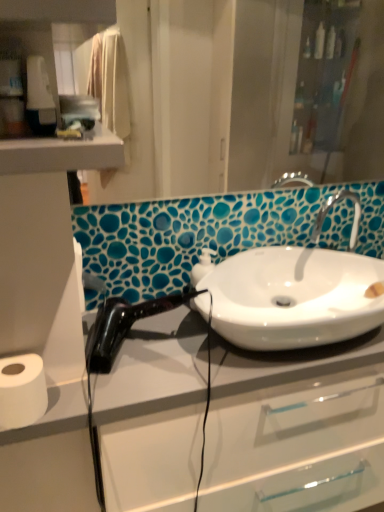
What do you see at coordinates (294, 297) in the screenshot? This screenshot has width=384, height=512. I see `white glossy sink at center` at bounding box center [294, 297].

What is the approximate width of black plastic hair dryer at upper left?

The width of black plastic hair dryer at upper left is 1.94 inches.

Locate an element on the screen. black glossy hair dryer at left is located at coordinates (123, 326).

What do you see at coordinates (22, 391) in the screenshot? I see `white matte toilet paper at lower left` at bounding box center [22, 391].

In order to face matte glass mirror at upper center, should I rotate leftwards or rightwards?

To face it directly, rotate right by 7.684 degrees.

The width and height of the screenshot is (384, 512). What are the coordinates of `white glossy sink at center` in the screenshot? It's located at (294, 297).

Relative to matte glass mirror at upper center, is black plastic hair dryer at upper left in front or behind?

Clearly, black plastic hair dryer at upper left is in front of matte glass mirror at upper center.

Could you tell me if black plastic hair dryer at upper left is turned towards matte glass mirror at upper center?

No.

From a real-world perspective, is black plastic hair dryer at upper left positioned over matte glass mirror at upper center based on gravity?

Yes, from a real-world perspective, black plastic hair dryer at upper left is on top of matte glass mirror at upper center.

From the image's perspective, which is below, white matte toilet paper at lower left or black glossy hair dryer at left?

From the image's view, white matte toilet paper at lower left is below.

Is white matte toilet paper at lower left bigger or smaller than black glossy hair dryer at left?

Clearly, white matte toilet paper at lower left is smaller in size than black glossy hair dryer at left.

Which object is closer to the camera, white matte toilet paper at lower left or black glossy hair dryer at left?

white matte toilet paper at lower left is more forward.

Based on their sizes in the image, would you say white glossy sink at center is bigger or smaller than matte glass mirror at upper center?

Considering their sizes, white glossy sink at center takes up more space than matte glass mirror at upper center.

Can you tell me how much white glossy sink at center and matte glass mirror at upper center differ in facing direction?

There is a 0.00346-degree angle between the facing directions of white glossy sink at center and matte glass mirror at upper center.

Is point (360, 272) closer or farther from the camera than point (31, 27)?

Point (360, 272).

From the image's perspective, is white matte toilet paper at lower left located above white glossy sink at center?

Incorrect, from the image's perspective, white matte toilet paper at lower left is lower than white glossy sink at center.

Are white matte toilet paper at lower left and white glossy sink at center far apart?

That's not correct — white matte toilet paper at lower left is a little close to white glossy sink at center.

Consider the image. Between white matte toilet paper at lower left and white glossy sink at center, which one has smaller size?

→ With smaller size is white matte toilet paper at lower left.

Consider the image. Is white matte toilet paper at lower left closer to camera compared to white glossy sink at center?

Yes, white matte toilet paper at lower left is closer to the viewer.

Are white matte toilet paper at lower left and matte glass mirror at upper center far apart?

white matte toilet paper at lower left is far away from matte glass mirror at upper center.

Which of these two, white matte toilet paper at lower left or matte glass mirror at upper center, is bigger?

Bigger between the two is matte glass mirror at upper center.

Can you tell me how much white matte toilet paper at lower left and matte glass mirror at upper center differ in facing direction?

The facing directions of white matte toilet paper at lower left and matte glass mirror at upper center are 0.00309 degrees apart.

From a real-world perspective, is white matte toilet paper at lower left physically below matte glass mirror at upper center?

Yes, from a real-world perspective, white matte toilet paper at lower left is under matte glass mirror at upper center.

The width and height of the screenshot is (384, 512). I want to click on mirror on the left side of white glossy sink at center, so click(x=189, y=88).

Is matte glass mirror at upper center oriented towards white glossy sink at center?

No, matte glass mirror at upper center does not turn towards white glossy sink at center.

Is point (48, 27) positioned behind point (224, 301)?

No, (48, 27) is closer to viewer.

Who is shorter, matte glass mirror at upper center or white glossy sink at center?

Standing shorter between the two is white glossy sink at center.

Which object is further away from the camera taking this photo, white glossy sink at center or black plastic hair dryer at upper left?

white glossy sink at center is more distant.

How distant is white glossy sink at center from black plastic hair dryer at upper left?

white glossy sink at center and black plastic hair dryer at upper left are 28.92 inches apart.

Considering the points (287, 316) and (30, 72), which point is behind, point (287, 316) or point (30, 72)?

Point (287, 316)

Locate an element on the screen. The height and width of the screenshot is (512, 384). mirror lying above the black plastic hair dryer at upper left (from the image's perspective) is located at coordinates (189, 88).

The image size is (384, 512). I want to click on toilet paper below the black glossy hair dryer at left (from a real-world perspective), so click(x=22, y=391).

Based on their spatial positions, is black glossy hair dryer at left or black plastic hair dryer at upper left closer to white matte toilet paper at lower left?

black glossy hair dryer at left is closer to white matte toilet paper at lower left.

Estimate the real-world distances between objects in this image. Which object is closer to white matte toilet paper at lower left, white glossy sink at center or black plastic hair dryer at upper left?

black plastic hair dryer at upper left is closer to white matte toilet paper at lower left.

Considering their positions, is white matte toilet paper at lower left positioned further to black glossy hair dryer at left than white glossy sink at center?

The object further to black glossy hair dryer at left is white matte toilet paper at lower left.

Considering their positions, is black glossy hair dryer at left positioned closer to white matte toilet paper at lower left than matte glass mirror at upper center?

black glossy hair dryer at left is closer to white matte toilet paper at lower left.

Estimate the real-world distances between objects in this image. Which object is further from black glossy hair dryer at left, white glossy sink at center or white matte toilet paper at lower left?

Among the two, white matte toilet paper at lower left is located further to black glossy hair dryer at left.

In the scene shown: Considering their positions, is white matte toilet paper at lower left positioned closer to white glossy sink at center than black plastic hair dryer at upper left?

Among the two, white matte toilet paper at lower left is located nearer to white glossy sink at center.

From the picture: Considering their positions, is white matte toilet paper at lower left positioned further to black plastic hair dryer at upper left than white glossy sink at center?

white glossy sink at center.

When comparing their distances from matte glass mirror at upper center, does white glossy sink at center or white matte toilet paper at lower left seem further?

white matte toilet paper at lower left is further to matte glass mirror at upper center.

Where is `hand dryer located between white matte toilet paper at lower left and white glossy sink at center in the left-right direction`? The height and width of the screenshot is (512, 384). hand dryer located between white matte toilet paper at lower left and white glossy sink at center in the left-right direction is located at coordinates (40, 98).

In order to click on hair drier between matte glass mirror at upper center and white matte toilet paper at lower left in the up-down direction in this screenshot , I will do `click(123, 326)`.

Image resolution: width=384 pixels, height=512 pixels. I want to click on mirror between black plastic hair dryer at upper left and white glossy sink at center, so click(189, 88).

This screenshot has width=384, height=512. What are the coordinates of `sink between matte glass mirror at upper center and black glossy hair dryer at left in the up-down direction` in the screenshot? It's located at (294, 297).